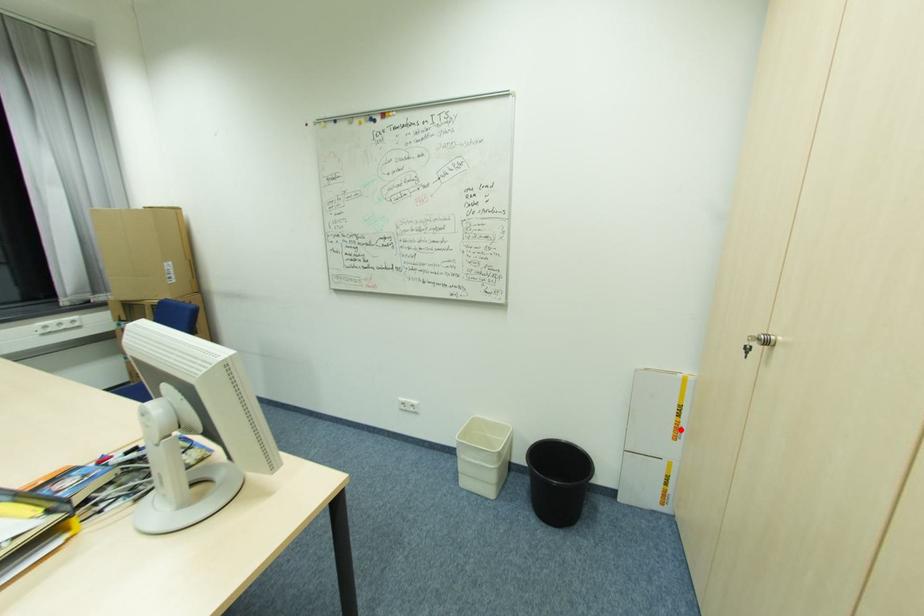
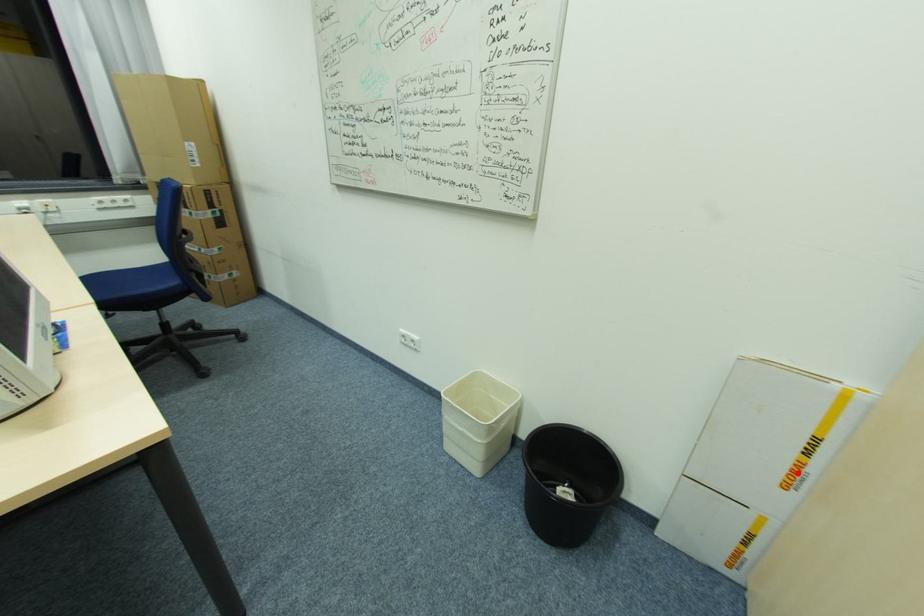
I am providing you with two images of the same scene from different viewpoints. A red point is marked on the first image and another point is marked on the second image. Is the red point in image1 aligned with the point shown in image2?

Yes